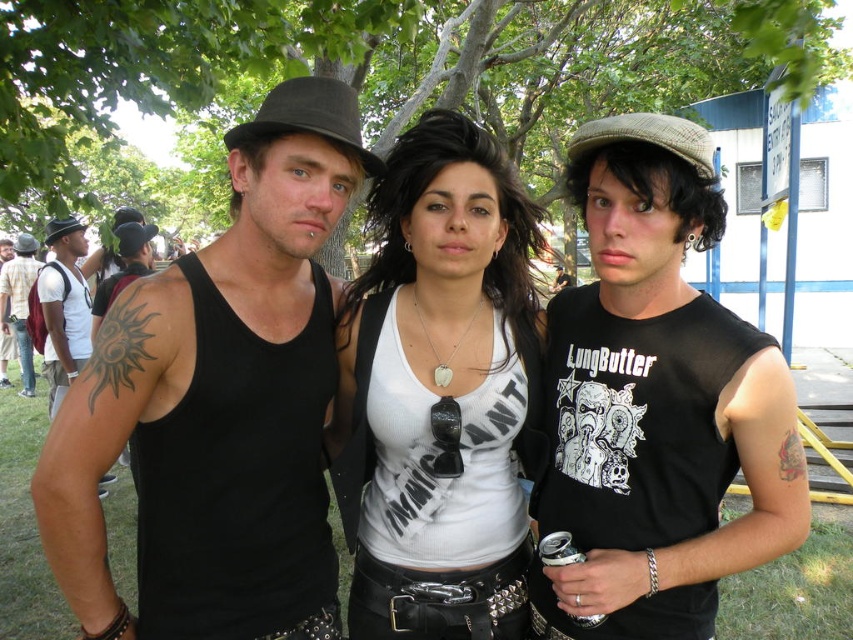
Who is higher up, black matte tank top at center or matte black tank top at left?

matte black tank top at left is above.

Which of these two, black matte tank top at center or matte black tank top at left, stands shorter?

With less height is black matte tank top at center.

Measure the distance between black matte tank top at center and camera.

They are 1.55 meters apart.

Find the location of `black matte tank top at center`. black matte tank top at center is located at coordinates (218, 403).

Can you confirm if black mesh tank top at center is wider than white matte tank top at center?

Yes, black mesh tank top at center is wider than white matte tank top at center.

Is black mesh tank top at center positioned in front of white matte tank top at center?

Yes.

Locate an element on the screen. This screenshot has width=853, height=640. black mesh tank top at center is located at coordinates (656, 401).

Does black mesh tank top at center have a lesser height compared to matte black tank top at left?

Yes, black mesh tank top at center is shorter than matte black tank top at left.

Between black mesh tank top at center and matte black tank top at left, which one appears on the left side from the viewer's perspective?

Positioned to the left is matte black tank top at left.

Is point (624, 433) in front of point (4, 324)?

Yes, point (624, 433) is closer to viewer.

Locate an element on the screen. Image resolution: width=853 pixels, height=640 pixels. black mesh tank top at center is located at coordinates (656, 401).